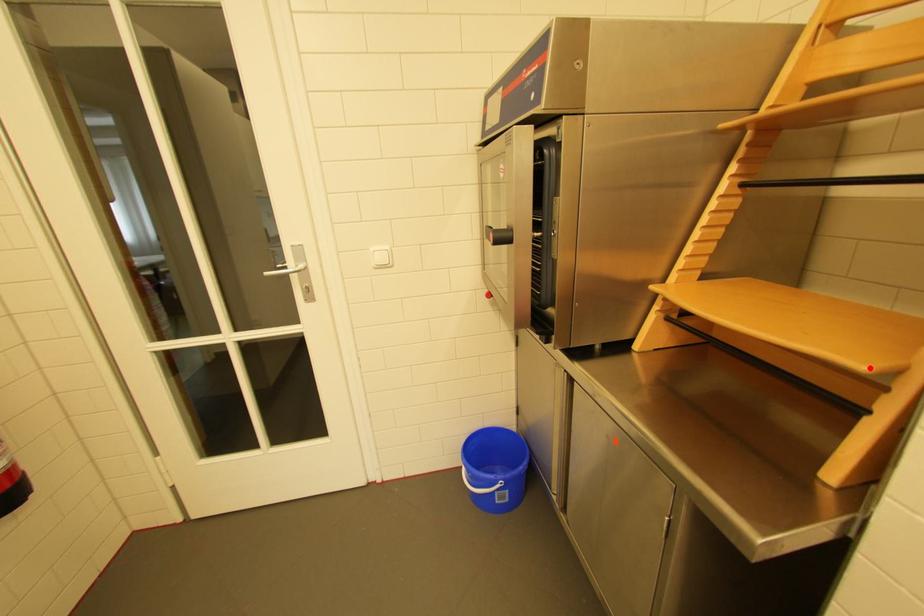
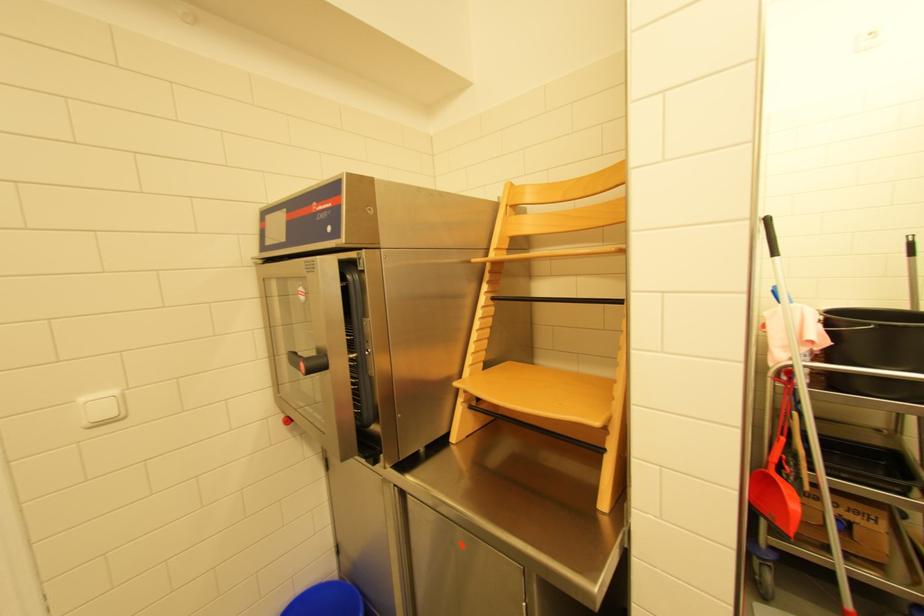
Where in the second image is the point corresponding to the highlighted location from the first image?

(603, 424)